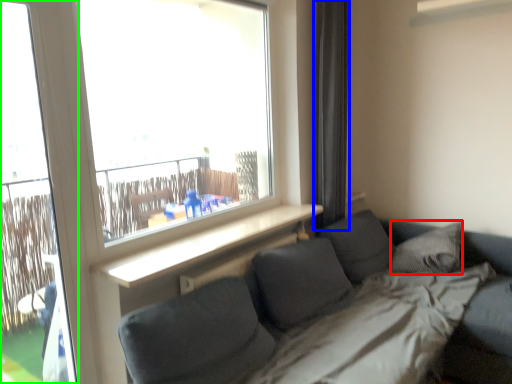
Question: Estimate the real-world distances between objects in this image. Which object is farther from pillow (highlighted by a red box), curtain (highlighted by a blue box) or screen door (highlighted by a green box)?

Choices:
 (A) curtain
 (B) screen door

Answer: (B)